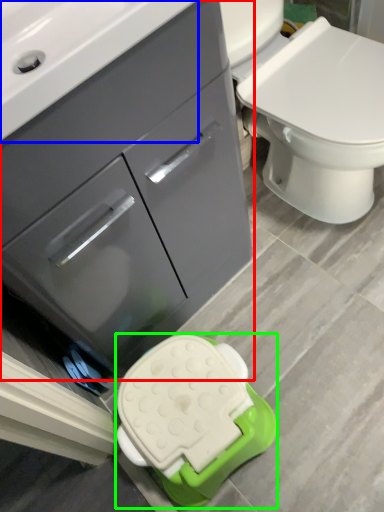
Question: Which object is the closest to the bathroom cabinet (highlighted by a red box)? Choose among these: sink (highlighted by a blue box) or porcelain (highlighted by a green box).

Choices:
 (A) sink
 (B) porcelain

Answer: (A)